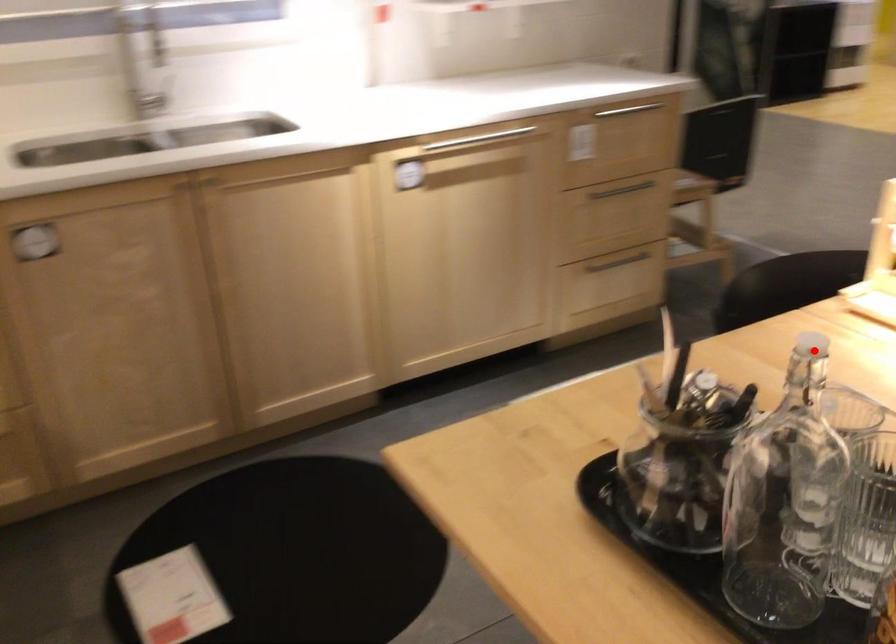
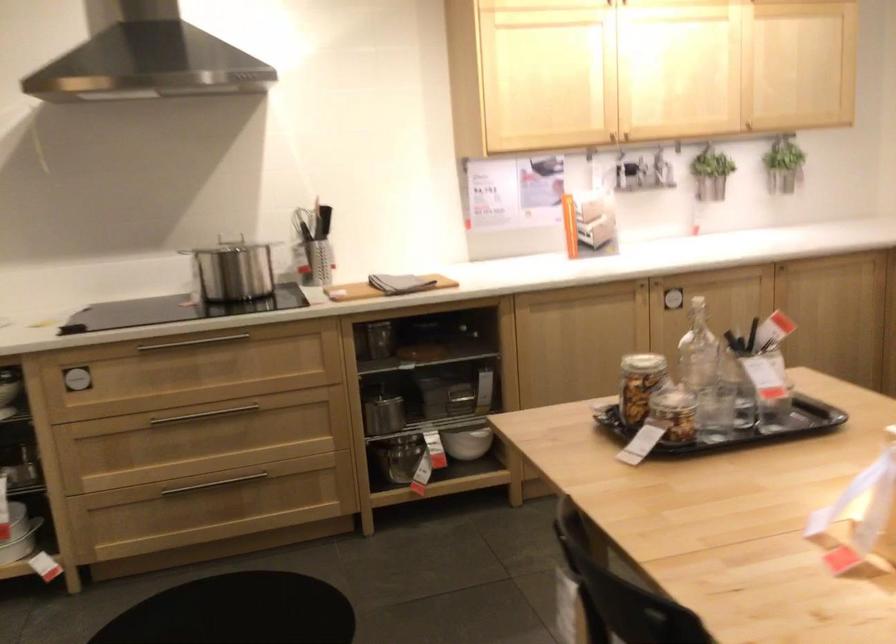
Question: I am providing you with two images of the same scene from different viewpoints. A red point is marked on the first image. Can you still see the location of the red point in image 2?

Choices:
 (A) Yes
 (B) No

Answer: (B)